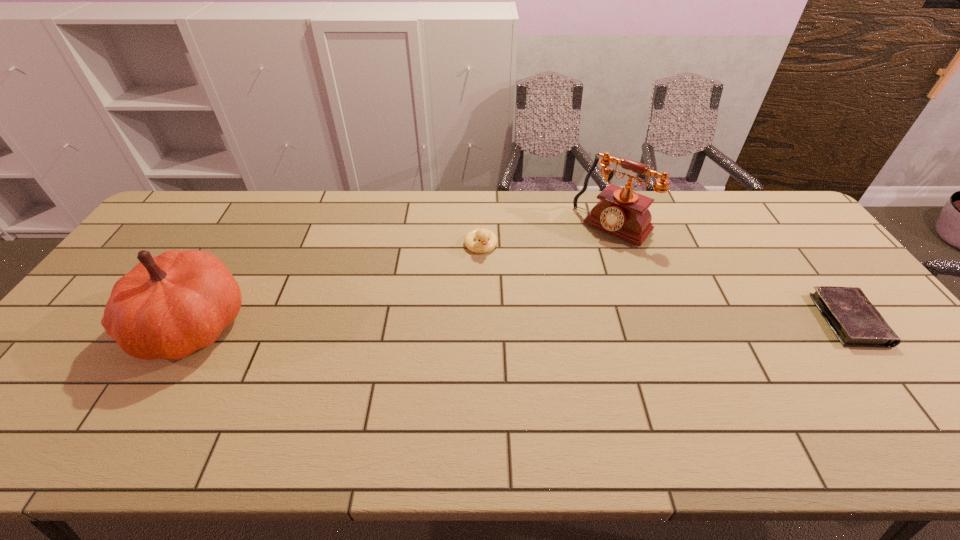
This screenshot has height=540, width=960. What are the coordinates of `empty location between the third tallest object and the diary` in the screenshot? It's located at (664, 283).

Where is `empty space that is in between the pumpkin and the diary`? empty space that is in between the pumpkin and the diary is located at coordinates [x=520, y=322].

Find the location of a particular element. The width and height of the screenshot is (960, 540). vacant area between the shortest object and the pumpkin is located at coordinates (520, 322).

At what (x,y) coordinates should I click in order to perform the action: click on vacant area that lies between the second shortest object and the telephone. Please return your answer as a coordinate pair (x, y). The height and width of the screenshot is (540, 960). Looking at the image, I should click on (547, 236).

You are a GUI agent. You are given a task and a screenshot of the screen. Output one action in this format:
    pyautogui.click(x=<x>, y=<y>)
    Task: Click on the vacant space in between the telephone and the rightmost object
    This screenshot has height=540, width=960.
    Given the screenshot: What is the action you would take?
    click(731, 273)

What are the coordinates of `vacant region between the telephone and the leftmost object` in the screenshot? It's located at (403, 276).

Identify which object is located as the third nearest to the rightmost object. Please provide its 2D coordinates. Your answer should be formatted as a tuple, i.e. [(x, y)], where the tuple contains the x and y coordinates of a point satisfying the conditions above.

[(167, 307)]

At what (x,y) coordinates should I click in order to perform the action: click on the third closest object to the telephone. Please return your answer as a coordinate pair (x, y). Looking at the image, I should click on (167, 307).